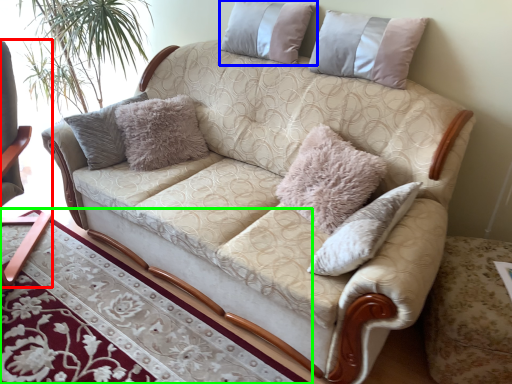
Question: Which is nearer to the rocking chair (highlighted by a red box)? pillow (highlighted by a blue box) or table (highlighted by a green box).

Choices:
 (A) pillow
 (B) table

Answer: (B)